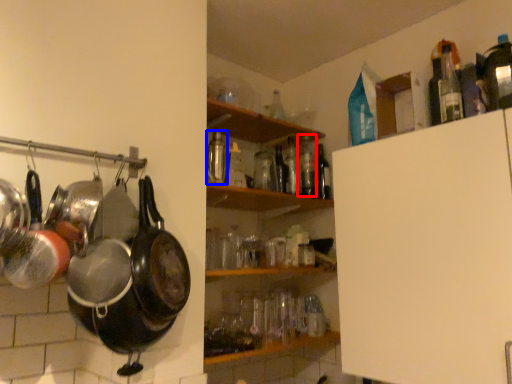
Question: Which object is further to the camera taking this photo, bottle (highlighted by a red box) or bottle (highlighted by a blue box)?

Choices:
 (A) bottle
 (B) bottle

Answer: (A)